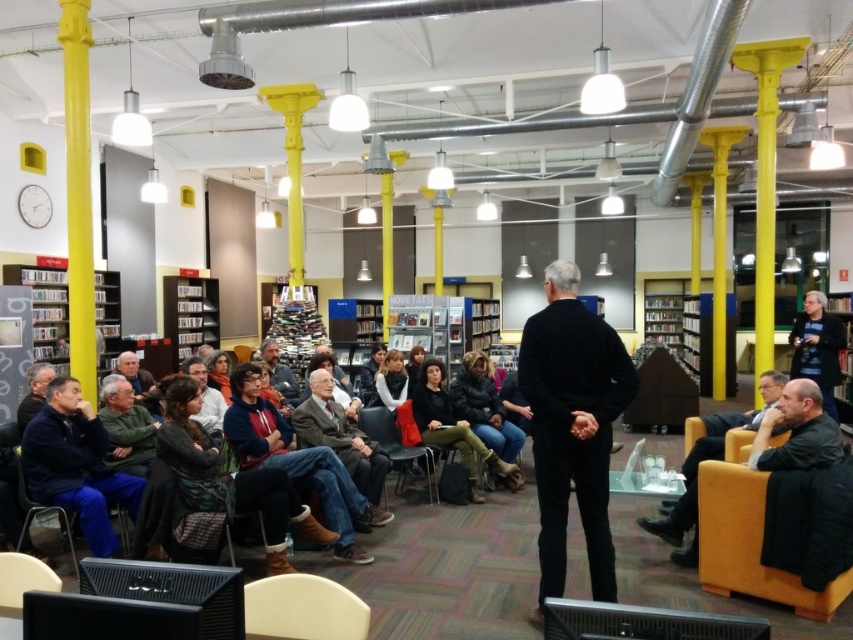
Is dark gray fabric jacket at center taller than dark gray sweater at center?

Yes.

Locate an element on the screen. The width and height of the screenshot is (853, 640). dark gray fabric jacket at center is located at coordinates (341, 442).

Who is higher up, matte black jacket at lower center or metallic gray chair at lower left?

matte black jacket at lower center is higher up.

Who is more distant from viewer, (207, 394) or (25, 529)?

Positioned behind is point (207, 394).

Does point (209, 404) lie behind point (22, 529)?

Yes, it is.

The height and width of the screenshot is (640, 853). I want to click on matte black jacket at lower center, so click(206, 396).

Is matte black chair at center further to the viewer compared to dark gray sweater at center?

No, matte black chair at center is closer to the viewer.

Measure the distance between matte black chair at center and camera.

4.99 meters

What are the coordinates of `matte black chair at center` in the screenshot? It's located at [397, 449].